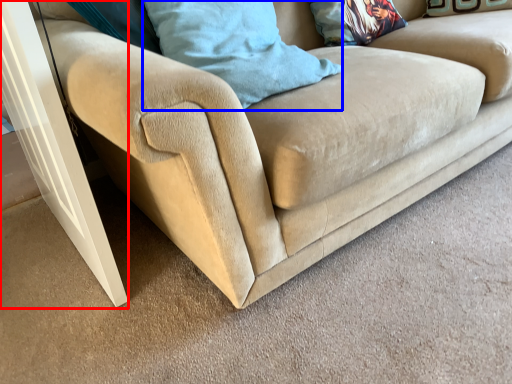
Question: Which object appears closest to the camera in this image, screen door (highlighted by a red box) or pillow (highlighted by a blue box)?

Choices:
 (A) screen door
 (B) pillow

Answer: (A)